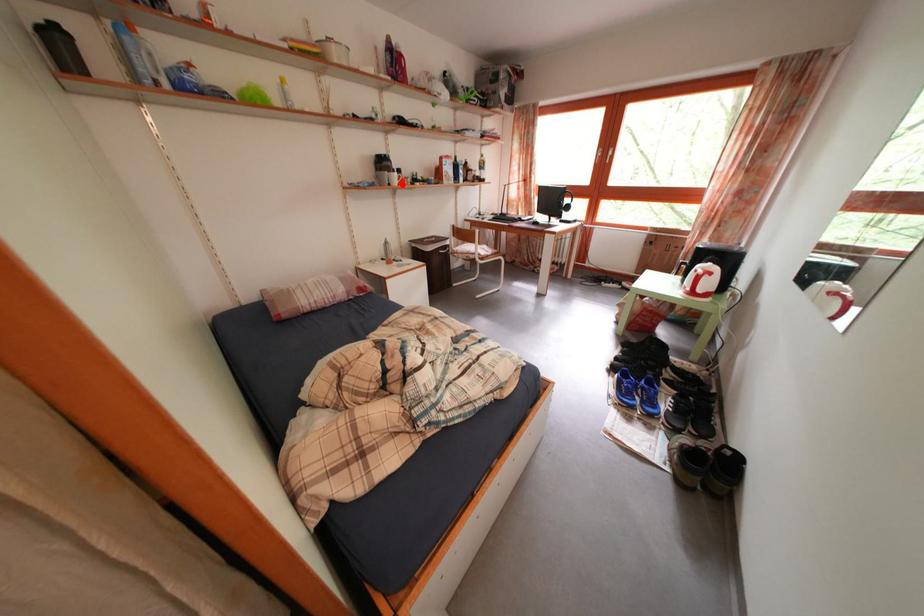
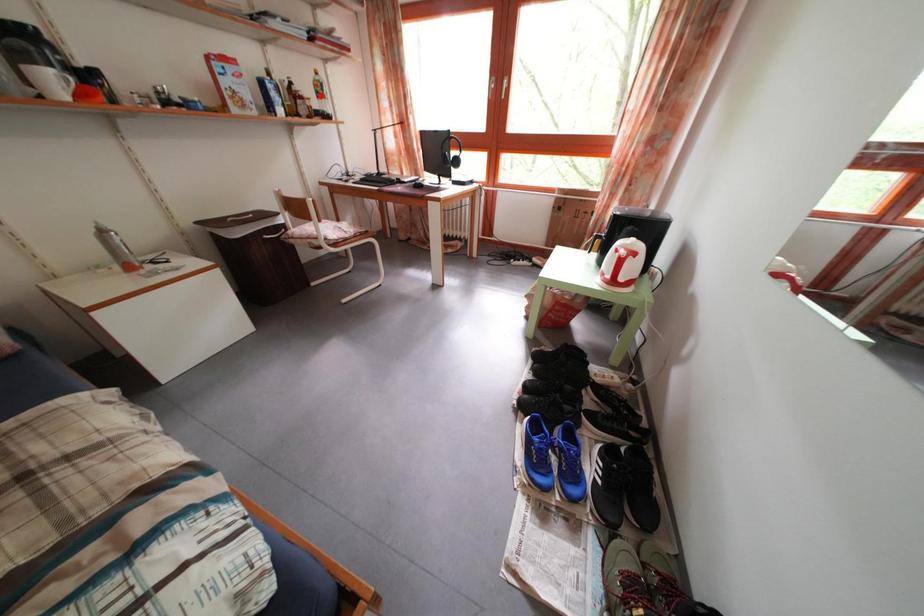
Looking at this image, I am providing you with two images of the same scene from different viewpoints. A red point is marked on the first image and another point is marked on the second image. Is the marked point in image1 the same physical position as the marked point in image2?

No